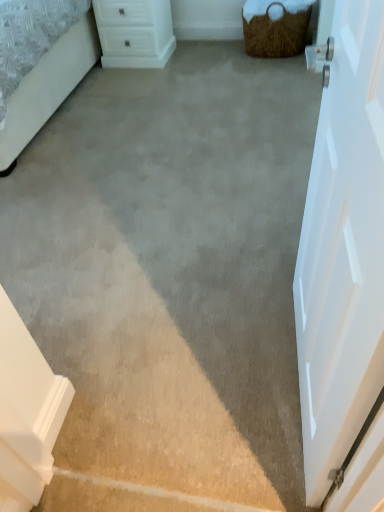
Question: Does white plastic chest of drawers at upper center have a larger size compared to white smooth door at right?

Choices:
 (A) no
 (B) yes

Answer: (B)

Question: Is white plastic chest of drawers at upper center positioned before white smooth door at right?

Choices:
 (A) no
 (B) yes

Answer: (A)

Question: Can you confirm if white plastic chest of drawers at upper center is shorter than white smooth door at right?

Choices:
 (A) no
 (B) yes

Answer: (B)

Question: Does white plastic chest of drawers at upper center have a smaller size compared to white smooth door at right?

Choices:
 (A) yes
 (B) no

Answer: (B)

Question: Is white plastic chest of drawers at upper center at the right side of white smooth door at right?

Choices:
 (A) no
 (B) yes

Answer: (A)

Question: Based on their positions, is white plastic chest of drawers at upper center located to the left or right of brown woven basket at upper right?

Choices:
 (A) right
 (B) left

Answer: (B)

Question: In terms of size, does white plastic chest of drawers at upper center appear bigger or smaller than brown woven basket at upper right?

Choices:
 (A) big
 (B) small

Answer: (A)

Question: In the image, is white plastic chest of drawers at upper center positioned in front of or behind brown woven basket at upper right?

Choices:
 (A) front
 (B) behind

Answer: (B)

Question: Do you think white plastic chest of drawers at upper center is within brown woven basket at upper right, or outside of it?

Choices:
 (A) inside
 (B) outside

Answer: (B)

Question: Considering the positions of point (340, 260) and point (259, 11), is point (340, 260) closer or farther from the camera than point (259, 11)?

Choices:
 (A) closer
 (B) farther

Answer: (A)

Question: From the image's perspective, is white smooth door at right located above or below brown woven basket at upper right?

Choices:
 (A) below
 (B) above

Answer: (A)

Question: Is white smooth door at right taller or shorter than brown woven basket at upper right?

Choices:
 (A) tall
 (B) short

Answer: (A)

Question: Based on their sizes in the image, would you say white smooth door at right is bigger or smaller than brown woven basket at upper right?

Choices:
 (A) big
 (B) small

Answer: (B)

Question: Is white smooth door at right taller or shorter than white plastic chest of drawers at upper center?

Choices:
 (A) tall
 (B) short

Answer: (A)

Question: Looking at their shapes, would you say white smooth door at right is wider or thinner than white plastic chest of drawers at upper center?

Choices:
 (A) wide
 (B) thin

Answer: (B)